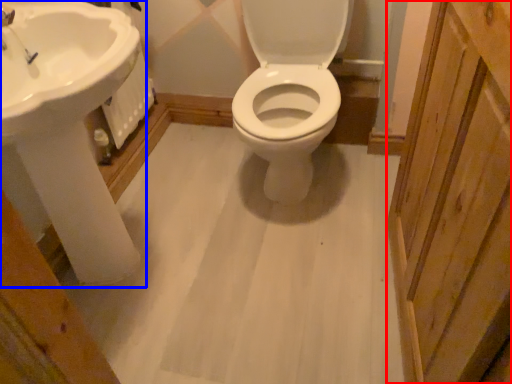
Question: Which object is further to the camera taking this photo, screen door (highlighted by a red box) or sink (highlighted by a blue box)?

Choices:
 (A) screen door
 (B) sink

Answer: (B)